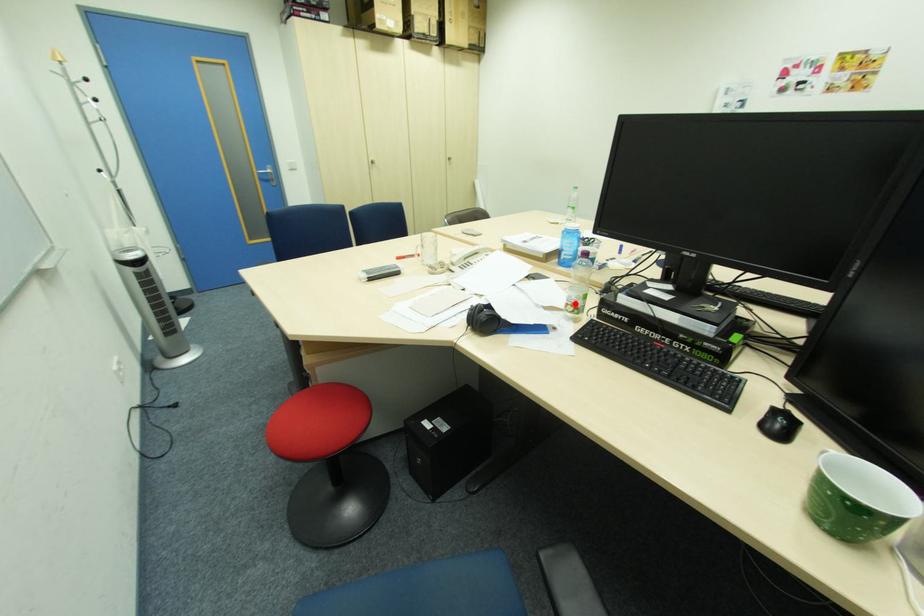
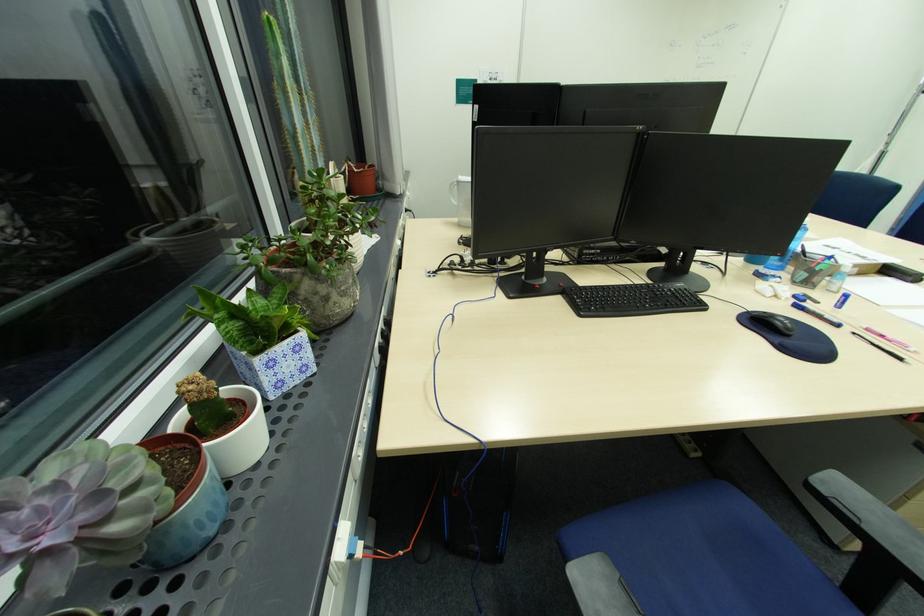
Question: I am providing you with two images of the same scene from different viewpoints. A red point is marked on the first image. Is the red point's position out of view in image 2?

Choices:
 (A) Yes
 (B) No

Answer: (A)